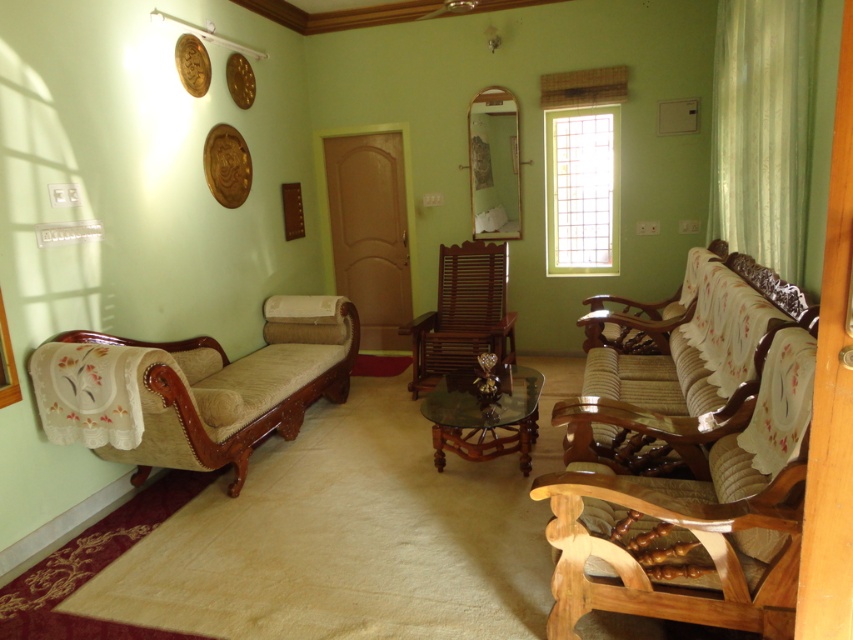
You are a guest entering the living room and want to sit down. You see the beige fabric daybed at left and the transparent glass table at center. Which object is closer to you as you enter the room?

The beige fabric daybed at left is closer to you because it is in front of the transparent glass table at center, meaning it is positioned nearer to your entrance point.

You are standing in the living room and want to place a 1.5 meter long sofa. The sofa needs to be placed at the point marked as point (231, 493). Is there enough space around this point to fit the sofa?

The point (231, 493) is 3.35 meters away from the camera. Since the sofa is 1.5 meters long, there is sufficient space around the point to accommodate it.

You are standing in the living room and want to place a small table exactly in the center of the room. The room has a mahogany wood rocking chair at center. Can you place the table there?

The mahogany wood rocking chair at center is already occupying the center position at point (462, 314), so you cannot place the table there.